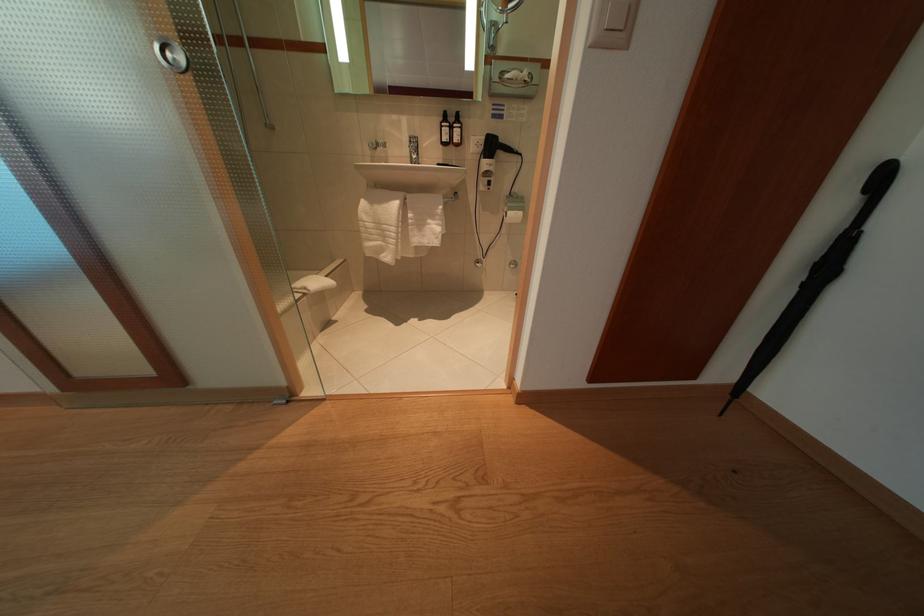
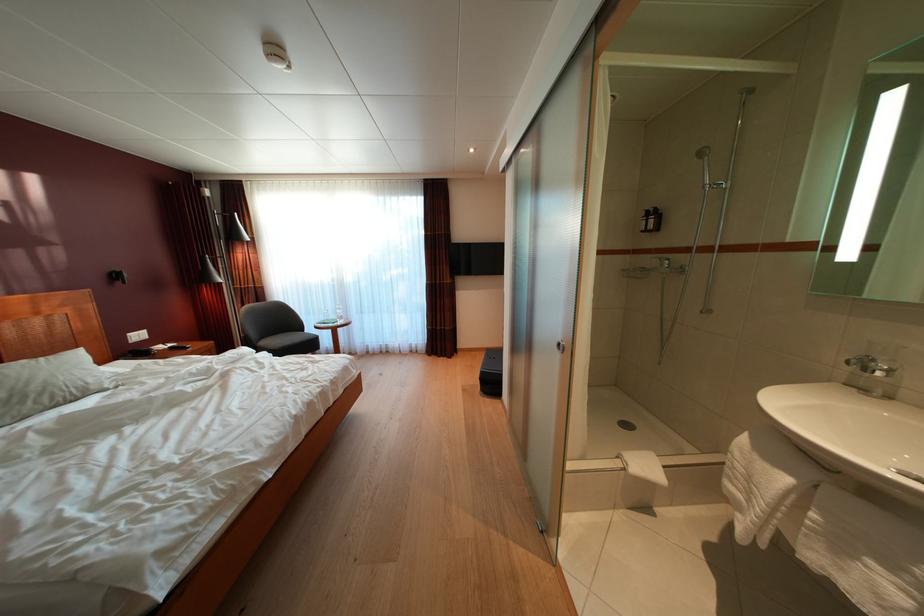
In the second image, find the point that corresponds to [386,151] in the first image.

(871, 376)